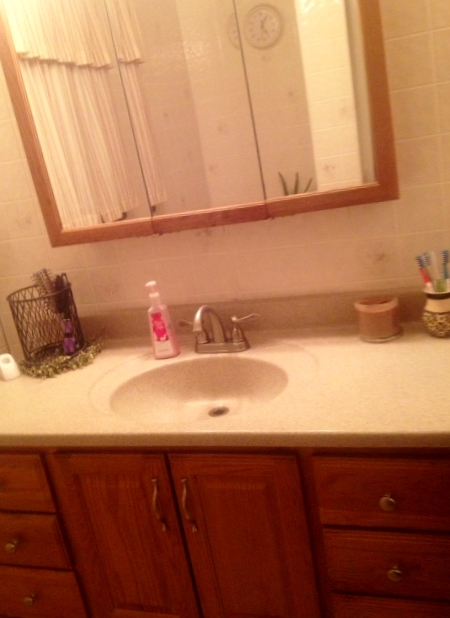
The height and width of the screenshot is (618, 450). In order to click on reflection of wall-hanging white clock in this screenshot , I will do `click(260, 28)`, `click(234, 31)`.